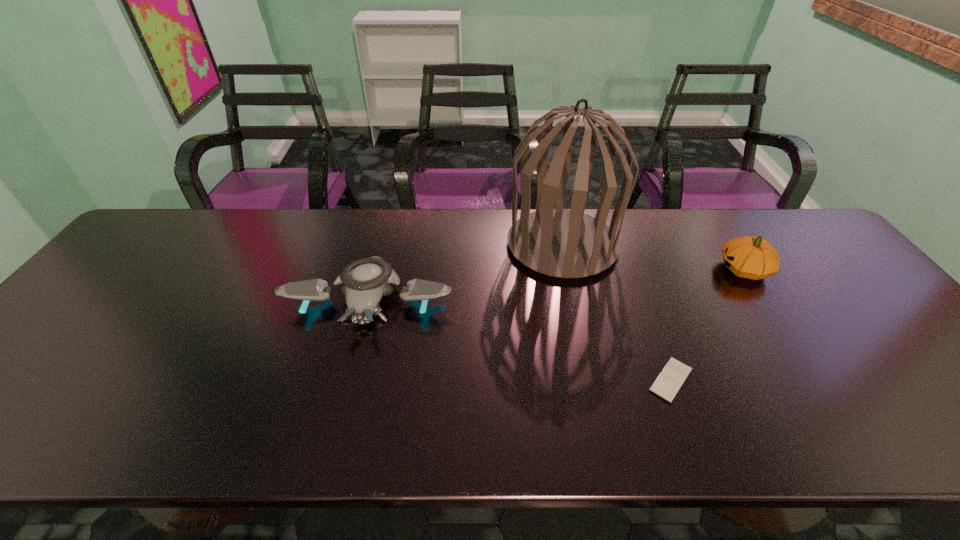
Where is `vacant space at the far right corner of the desktop`? This screenshot has height=540, width=960. vacant space at the far right corner of the desktop is located at coordinates (763, 230).

Locate an element on the screen. The width and height of the screenshot is (960, 540). vacant space at the near right corner of the desktop is located at coordinates (912, 417).

At what (x,y) coordinates should I click in order to perform the action: click on empty space between the rightmost object and the shortest object. Please return your answer as a coordinate pair (x, y). Image resolution: width=960 pixels, height=540 pixels. Looking at the image, I should click on (708, 325).

I want to click on vacant region between the leftmost object and the shortest object, so click(x=520, y=340).

I want to click on unoccupied area between the third shortest object and the birdcage, so click(653, 257).

The image size is (960, 540). What are the coordinates of `empty space that is in between the third tallest object and the diary` in the screenshot? It's located at (520, 340).

This screenshot has width=960, height=540. Find the location of `vacant point located between the gourd and the second shortest object`. vacant point located between the gourd and the second shortest object is located at coordinates (557, 285).

What are the coordinates of `free point between the rightmost object and the tallest object` in the screenshot? It's located at (653, 257).

Where is `free space between the diary and the tallest object`? This screenshot has width=960, height=540. free space between the diary and the tallest object is located at coordinates (616, 313).

You are a GUI agent. You are given a task and a screenshot of the screen. Output one action in this format:
    pyautogui.click(x=<x>, y=<y>)
    Task: Click on the free space between the second tallest object and the diary
    This screenshot has width=960, height=540.
    Given the screenshot: What is the action you would take?
    pyautogui.click(x=708, y=325)